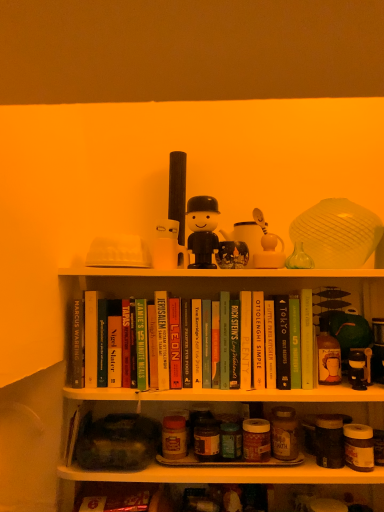
This screenshot has height=512, width=384. In order to click on free space in front of hardcover book at center, which appears as the 14th paperback book when viewed from the right in this screenshot , I will do `click(89, 387)`.